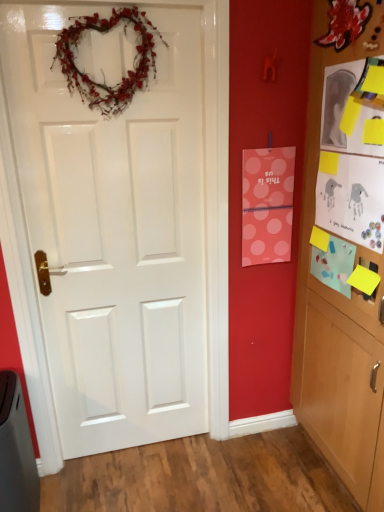
Identify the location of vacant area on top of white glossy door at center (from a real-world perspective). The height and width of the screenshot is (512, 384). (114, 4).